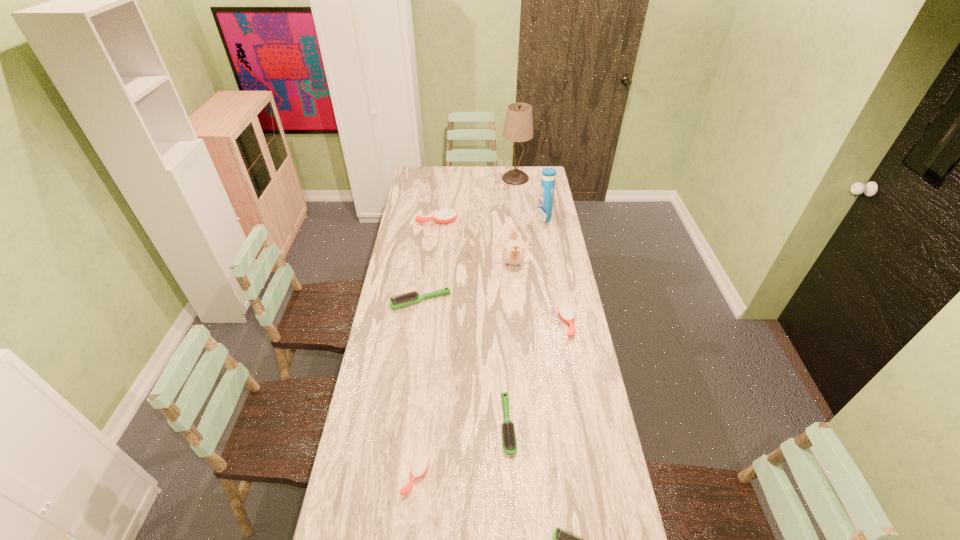
Find the location of a particular element. The height and width of the screenshot is (540, 960). the biggest light hairbrush is located at coordinates (410, 298).

Locate an element on the screen. the second light hairbrush from left to right is located at coordinates (509, 440).

Image resolution: width=960 pixels, height=540 pixels. In order to click on the third nearest object in this screenshot , I will do `click(509, 440)`.

The width and height of the screenshot is (960, 540). In order to click on the second nearest object in this screenshot , I will do `click(420, 465)`.

The image size is (960, 540). I want to click on the smallest orange hairbrush, so click(x=420, y=465).

Find the location of a particular element. This screenshot has width=960, height=540. vacant space located 0.310m on the front-facing side of the tallest object is located at coordinates (519, 215).

Image resolution: width=960 pixels, height=540 pixels. I want to click on vacant space located on the front-facing side of the detergent, so click(524, 217).

At what (x,y) coordinates should I click in order to perform the action: click on vacant space located 0.180m on the front-facing side of the detergent. Please return your answer as a coordinate pair (x, y). This screenshot has width=960, height=540. Looking at the image, I should click on (504, 217).

The height and width of the screenshot is (540, 960). Find the location of `free space located 0.260m on the front-facing side of the detergent`. free space located 0.260m on the front-facing side of the detergent is located at coordinates (490, 217).

At what (x,y) coordinates should I click in order to perform the action: click on free space located 0.050m at the beak of the white bird. Please return your answer as a coordinate pair (x, y). The height and width of the screenshot is (540, 960). Looking at the image, I should click on (515, 285).